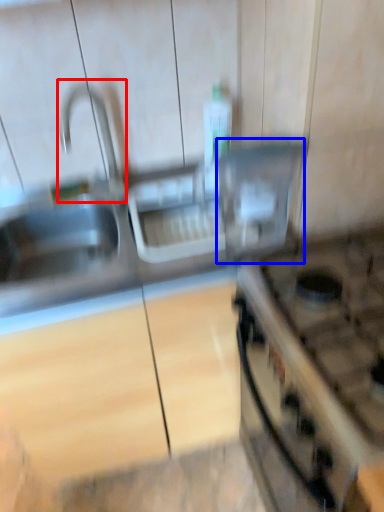
Question: Which object appears closest to the camera in this image, faucet (highlighted by a red box) or appliance (highlighted by a blue box)?

Choices:
 (A) faucet
 (B) appliance

Answer: (B)